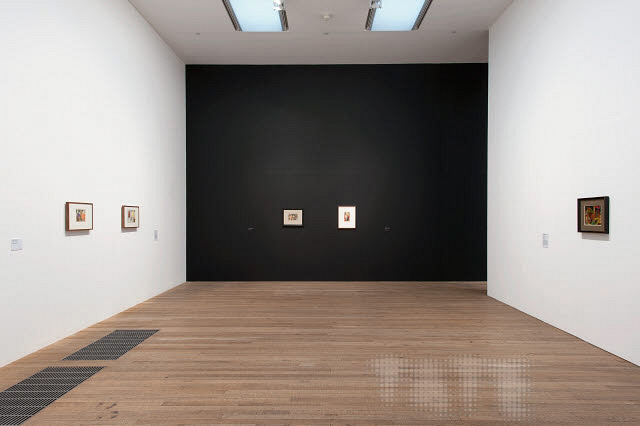
Where is `2 frames on the wall on the left`? The height and width of the screenshot is (426, 640). 2 frames on the wall on the left is located at coordinates (76, 224), (137, 220).